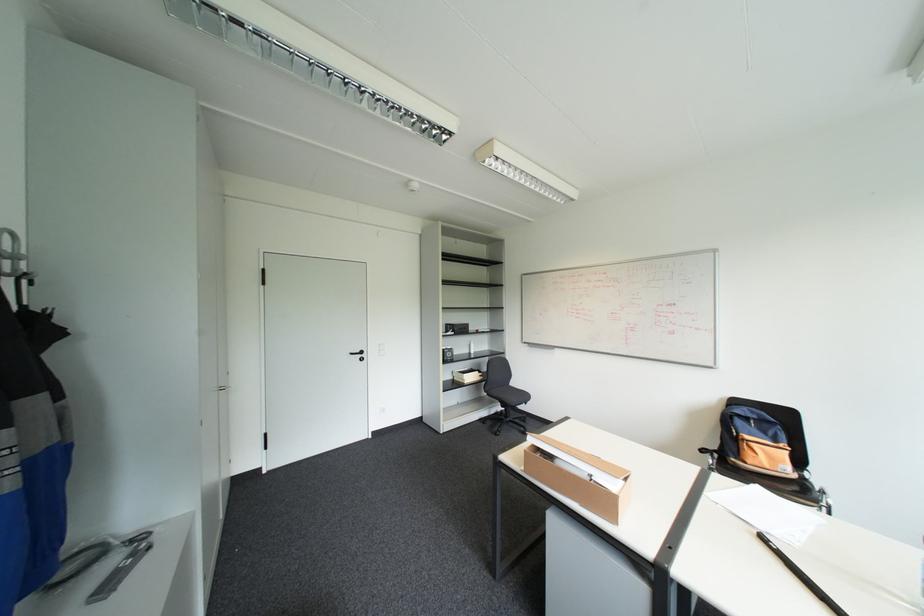
The image size is (924, 616). I want to click on black chair sitting surface, so click(512, 395).